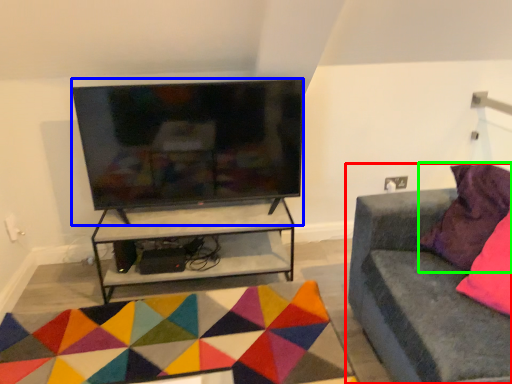
Question: Which object is the closest to the studio couch (highlighted by a red box)? Choose among these: television (highlighted by a blue box) or pillow (highlighted by a green box).

Choices:
 (A) television
 (B) pillow

Answer: (B)